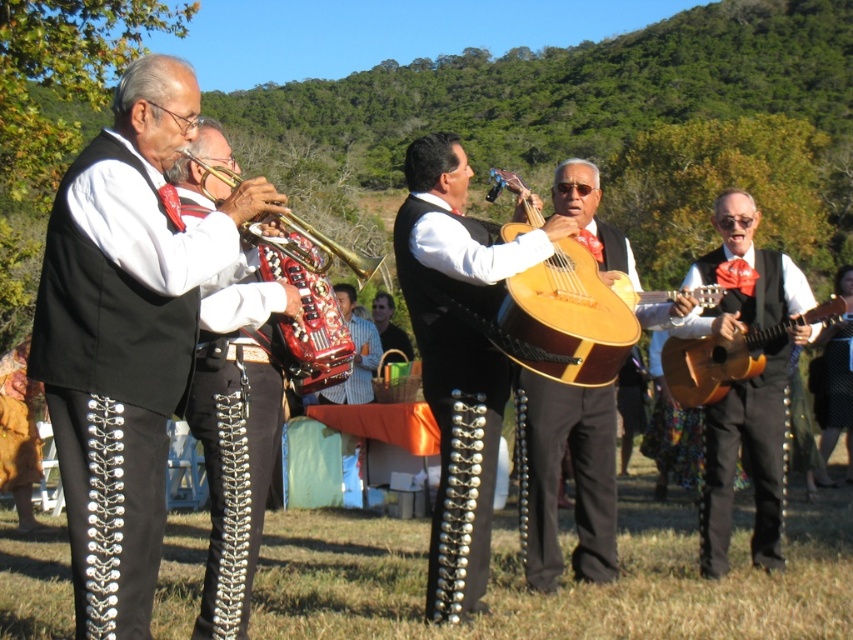
Question: Which object appears closest to the camera in this image?

Choices:
 (A) shiny gold guitar at center
 (B) light brown wooden guitar at right
 (C) wooden acoustic guitar at center

Answer: (C)

Question: Which object is farther from the camera taking this photo?

Choices:
 (A) shiny black pants at left
 (B) light brown wooden guitar at right
 (C) matte black vest at left
 (D) shiny gold guitar at center

Answer: (B)

Question: Is shiny gold guitar at center to the right of light wood acoustic guitar at center from the viewer's perspective?

Choices:
 (A) yes
 (B) no

Answer: (B)

Question: Considering the relative positions of matte brown guitar at right and wooden acoustic guitar at center in the image provided, where is matte brown guitar at right located with respect to wooden acoustic guitar at center?

Choices:
 (A) right
 (B) left

Answer: (A)

Question: Does shiny gold guitar at center come in front of gold plated trumpet at left?

Choices:
 (A) no
 (B) yes

Answer: (A)

Question: Which object is closer to the camera taking this photo?

Choices:
 (A) shiny black pants at left
 (B) matte black vest at left
 (C) matte brown guitar at right
 (D) shiny gold guitar at center

Answer: (B)